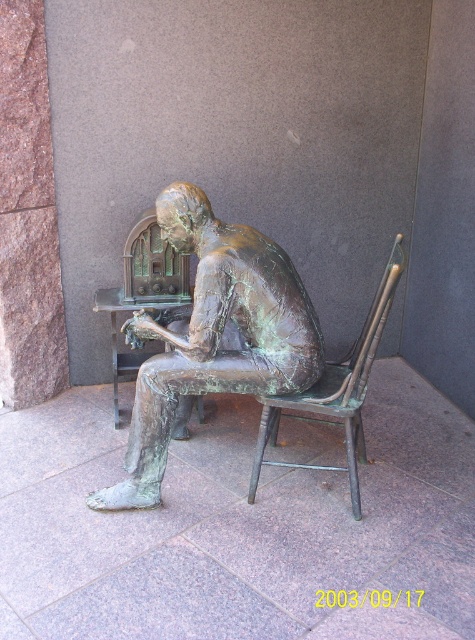
Question: Which object appears farthest from the camera in this image?

Choices:
 (A) green patina bronze statue at center
 (B) green patina wood chair at center
 (C) green patina metal chair at center

Answer: (B)

Question: Which point is closer to the camera?

Choices:
 (A) coord(127,236)
 (B) coord(220,273)
 (C) coord(376,307)

Answer: (B)

Question: Is green patina bronze statue at center thinner than green patina metal chair at center?

Choices:
 (A) no
 (B) yes

Answer: (A)

Question: Observing the image, what is the correct spatial positioning of green patina bronze statue at center in reference to green patina metal chair at center?

Choices:
 (A) below
 (B) above

Answer: (B)

Question: Is green patina bronze statue at center further to camera compared to green patina wood chair at center?

Choices:
 (A) no
 (B) yes

Answer: (A)

Question: Among these objects, which one is nearest to the camera?

Choices:
 (A) green patina metal chair at center
 (B) green patina bronze statue at center

Answer: (A)